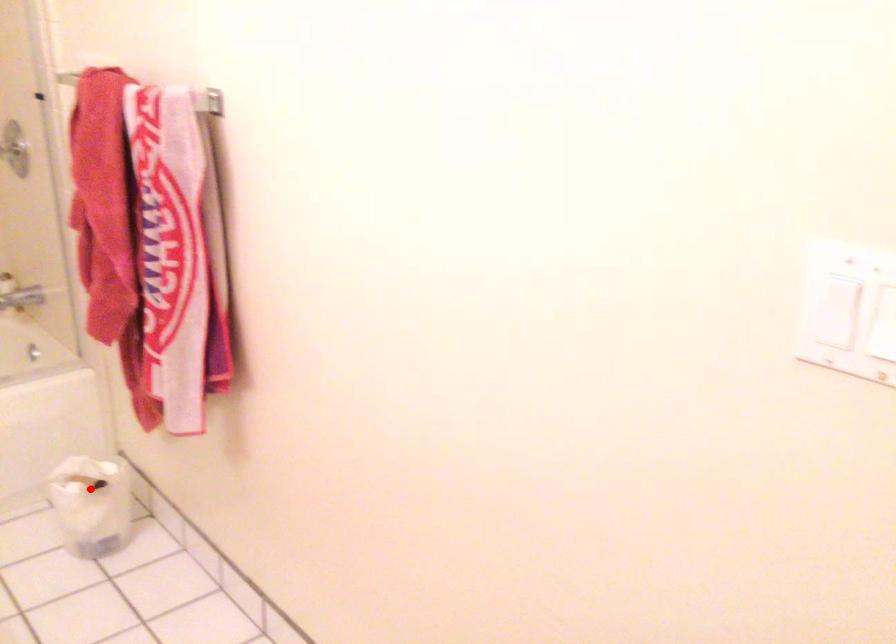
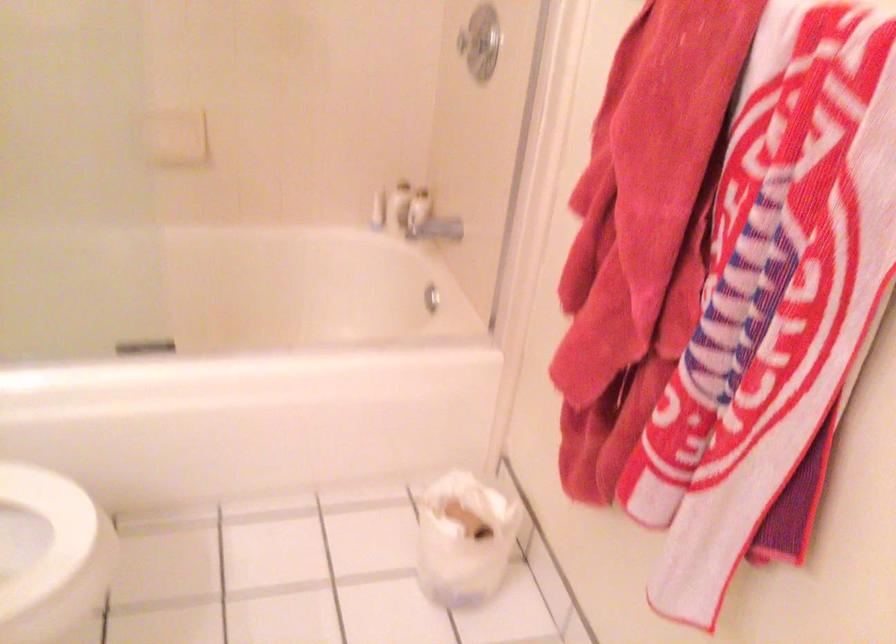
Locate, in the second image, the point that corresponds to the highlighted location in the first image.

(464, 538)